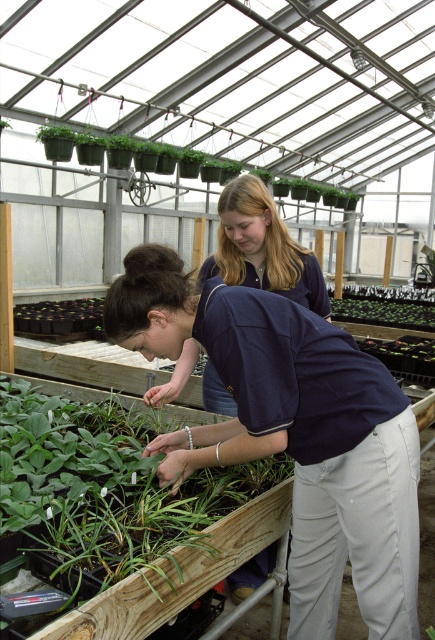
Does green leafy plant at center have a greater width compared to green matte plant at center?

In fact, green leafy plant at center might be narrower than green matte plant at center.

In the scene shown: Does green leafy plant at center have a lesser width compared to green matte plant at center?

Indeed, green leafy plant at center has a lesser width compared to green matte plant at center.

Does point (97, 474) come behind point (374, 320)?

No, it is not.

In order to click on green leafy plant at center in this screenshot , I will do `click(103, 486)`.

Does point (197, 310) lie behind point (254, 262)?

No.

Can you confirm if dark blue shirt at center is positioned to the left of blue cotton shirt at center?

Incorrect, dark blue shirt at center is not on the left side of blue cotton shirt at center.

The height and width of the screenshot is (640, 435). I want to click on dark blue shirt at center, so click(x=291, y=433).

This screenshot has height=640, width=435. In order to click on dark blue shirt at center in this screenshot , I will do `click(291, 433)`.

Can you confirm if green leafy plant at center is thinner than green matte hanging plants at upper center?

In fact, green leafy plant at center might be wider than green matte hanging plants at upper center.

Measure the distance between green leafy plant at center and camera.

1.28 meters

The height and width of the screenshot is (640, 435). What are the coordinates of `green leafy plant at center` in the screenshot? It's located at (103, 486).